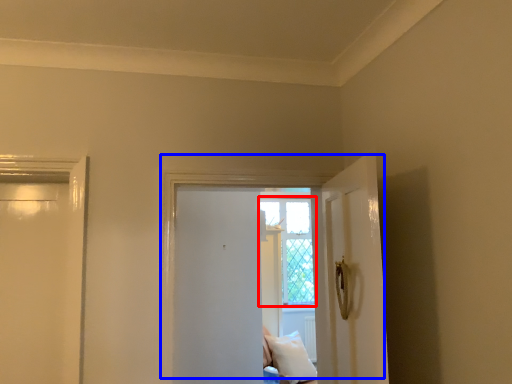
Question: Which object is further to the camera taking this photo, window (highlighted by a red box) or door (highlighted by a blue box)?

Choices:
 (A) window
 (B) door

Answer: (A)